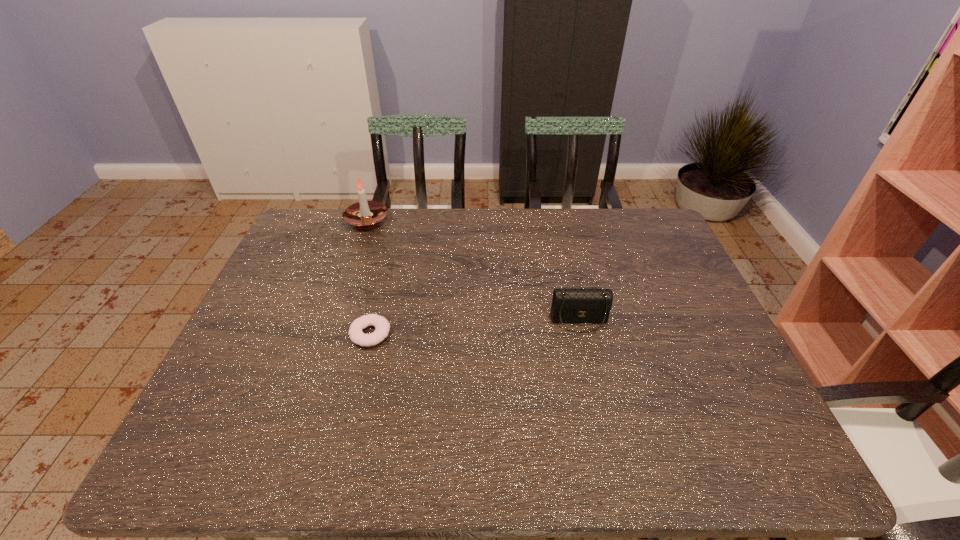
Locate an element on the screen. vacant region between the clutch bag and the farthest object is located at coordinates (473, 270).

Where is `vacant area that lies between the shortest object and the candle`? vacant area that lies between the shortest object and the candle is located at coordinates (369, 276).

Locate an element on the screen. free space between the clutch bag and the candle is located at coordinates [473, 270].

Image resolution: width=960 pixels, height=540 pixels. I want to click on blank region between the shortest object and the clutch bag, so click(475, 327).

Identify the location of unoccupied area between the second shortest object and the shortest object. (475, 327).

Locate an element on the screen. The image size is (960, 540). vacant space that's between the tallest object and the rightmost object is located at coordinates (473, 270).

Identify which object is the closest to the clutch bag. Please provide its 2D coordinates. Your answer should be formatted as a tuple, i.e. [(x, y)], where the tuple contains the x and y coordinates of a point satisfying the conditions above.

[(381, 324)]

Select which object is the closest to the clutch bag. Please provide its 2D coordinates. Your answer should be formatted as a tuple, i.e. [(x, y)], where the tuple contains the x and y coordinates of a point satisfying the conditions above.

[(381, 324)]

The height and width of the screenshot is (540, 960). I want to click on free spot that satisfies the following two spatial constraints: 1. on the front side of the doughnut; 2. on the right side of the candle, so click(x=329, y=333).

This screenshot has height=540, width=960. Identify the location of vacant space that satisfies the following two spatial constraints: 1. on the front side of the candle; 2. on the right side of the shortest object. (329, 333).